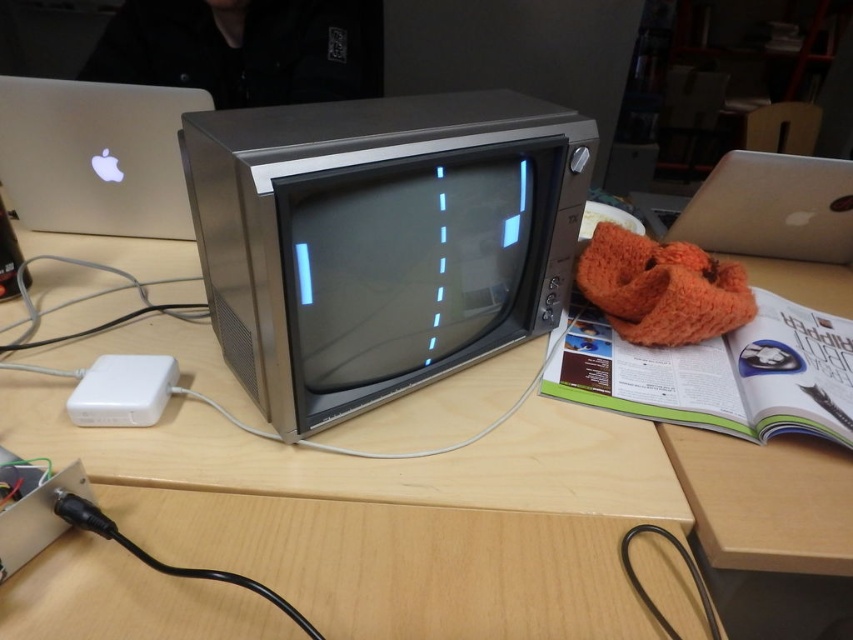
Which is more to the left, metallic wood desk at center or satin silver laptop at left?

Positioned to the left is satin silver laptop at left.

Can you confirm if metallic wood desk at center is positioned above satin silver laptop at left?

Actually, metallic wood desk at center is below satin silver laptop at left.

Is point (218, 422) less distant than point (134, 188)?

That is True.

Locate an element on the screen. metallic wood desk at center is located at coordinates (368, 460).

Who is higher up, metallic wood desk at center or silver metallic laptop at upper right?

silver metallic laptop at upper right is above.

Between metallic wood desk at center and silver metallic laptop at upper right, which one appears on the right side from the viewer's perspective?

silver metallic laptop at upper right is more to the right.

Between point (323, 624) and point (683, 234), which one is positioned in front?

Point (323, 624)

The width and height of the screenshot is (853, 640). I want to click on metallic wood desk at center, so click(x=368, y=460).

The height and width of the screenshot is (640, 853). What do you see at coordinates (96, 156) in the screenshot?
I see `satin silver laptop at left` at bounding box center [96, 156].

Who is more forward, [68,116] or [840,221]?

Positioned in front is point [68,116].

Locate an element on the screen. satin silver laptop at left is located at coordinates (96, 156).